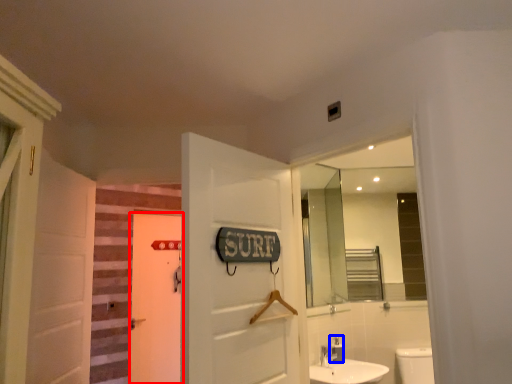
Question: Among these objects, which one is nearest to the camera, door (highlighted by a red box) or toiletry (highlighted by a blue box)?

Choices:
 (A) door
 (B) toiletry

Answer: (B)